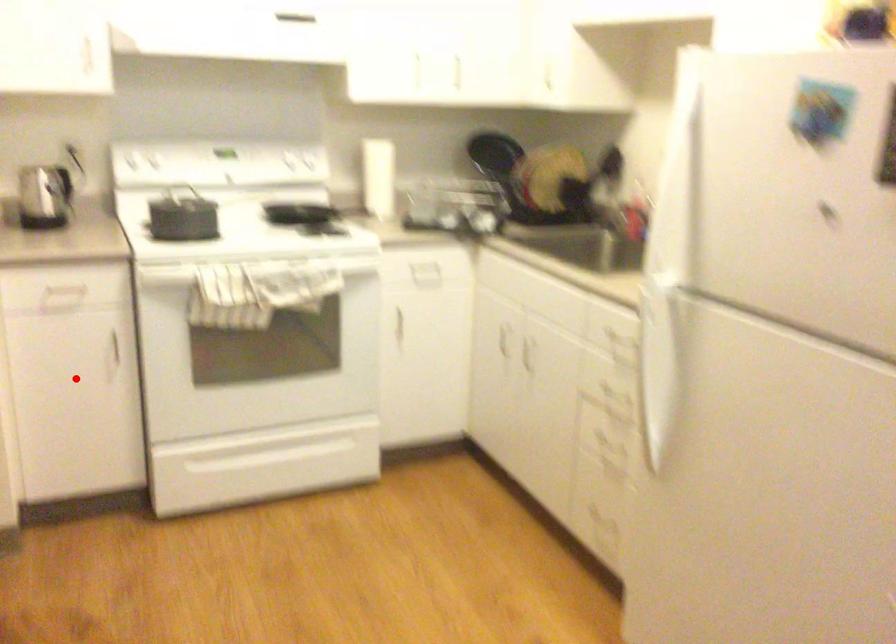
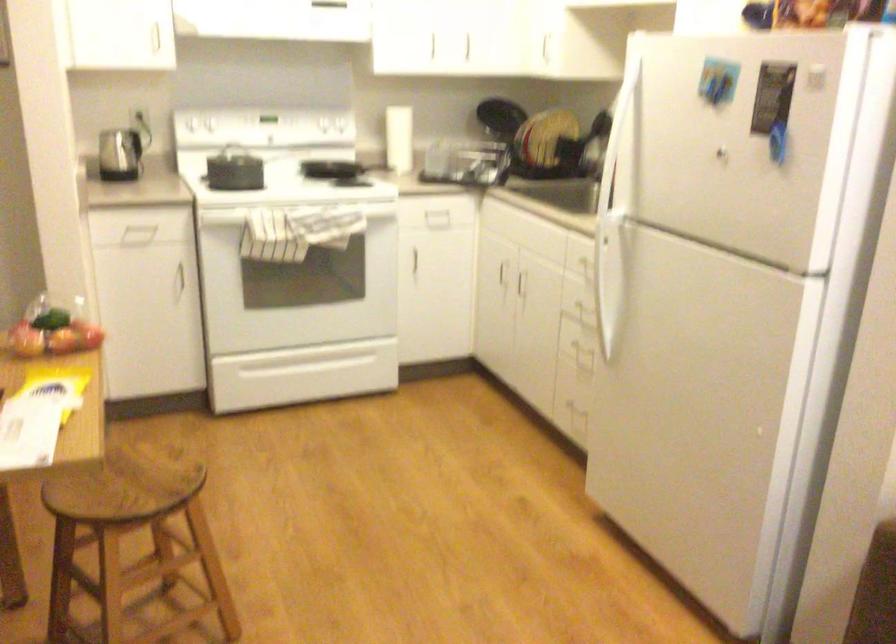
Find the pixel in the second image that matches the highlighted location in the first image.

(148, 299)